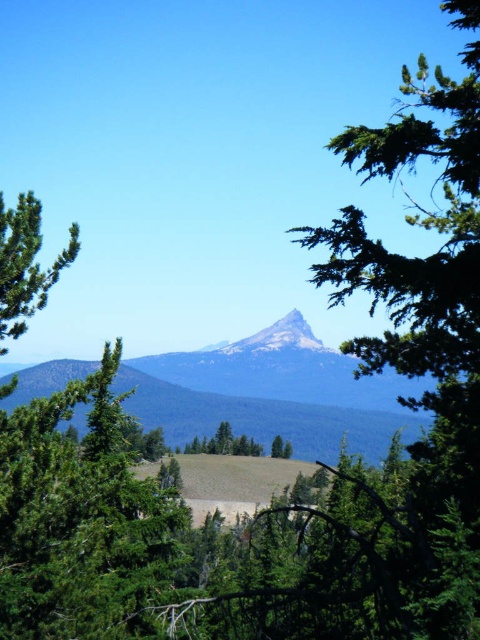
Question: Does green matte tree at left appear on the left side of green matte tree at center?

Choices:
 (A) no
 (B) yes

Answer: (B)

Question: Which point is farther to the camera?

Choices:
 (A) (351, 380)
 (B) (203, 448)

Answer: (A)

Question: Which is nearer to the green matte tree at left?

Choices:
 (A) smooth gray mountain at center
 (B) green matte tree at center

Answer: (B)

Question: Which object is the farthest from the green matte tree at center?

Choices:
 (A) green needle-like tree at center
 (B) smooth gray mountain at center
 (C) green matte tree at left

Answer: (C)

Question: Can you confirm if green needle-like tree at center is wider than smooth gray mountain at center?

Choices:
 (A) no
 (B) yes

Answer: (A)

Question: Observing the image, what is the correct spatial positioning of green needle-like tree at center in reference to green matte tree at center?

Choices:
 (A) right
 (B) left

Answer: (B)